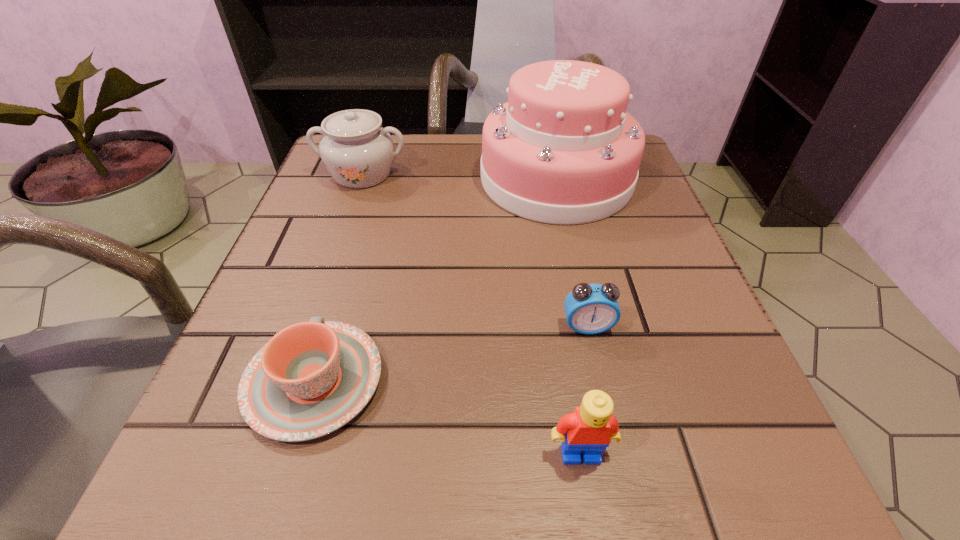
In order to click on vacant point that satisfies the following two spatial constraints: 1. on the handle side of the cake; 2. on the left side of the shortest object in this screenshot , I will do `click(376, 179)`.

The image size is (960, 540). Identify the location of vacant position in the image that satisfies the following two spatial constraints: 1. on the handle side of the cake; 2. on the right side of the shortest object. (376, 179).